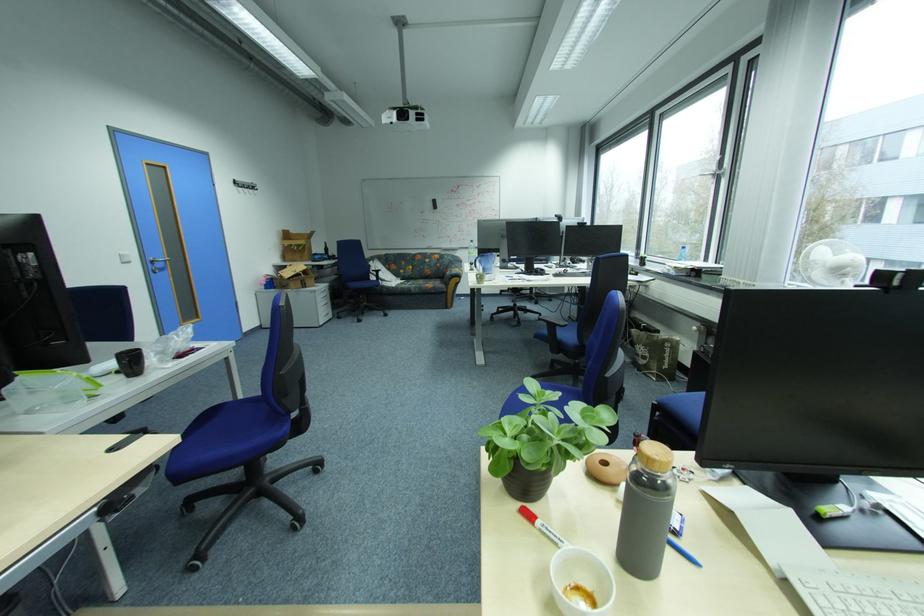
The image size is (924, 616). I want to click on chair armrest, so click(x=552, y=323).